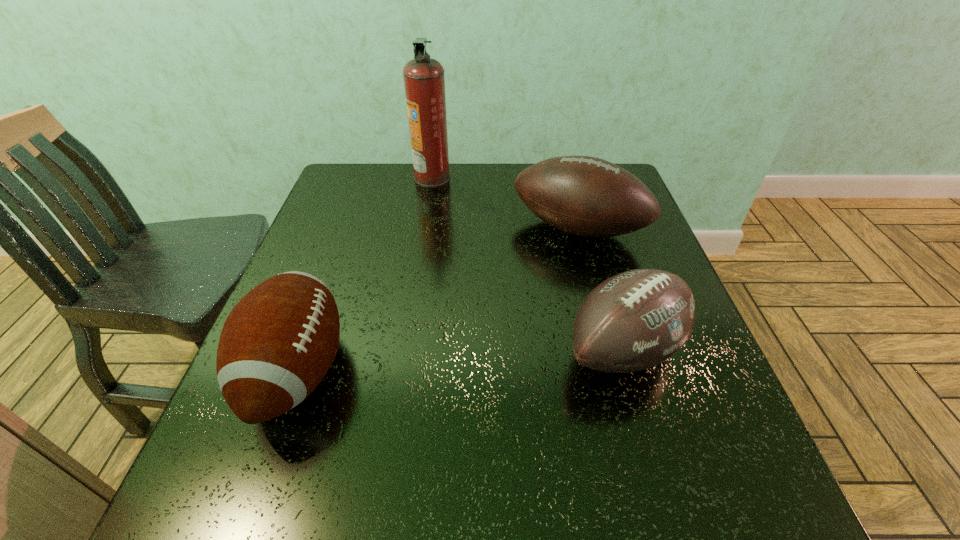
Locate an element on the screen. This screenshot has height=540, width=960. fire extinguisher is located at coordinates (424, 81).

This screenshot has width=960, height=540. Find the location of `the farthest object`. the farthest object is located at coordinates (424, 81).

This screenshot has width=960, height=540. In order to click on the second farthest object in this screenshot , I will do `click(586, 196)`.

In order to click on the leftmost football (American) in this screenshot , I will do `click(276, 345)`.

Where is `free space located at the nozzle of the fire extinguisher`? free space located at the nozzle of the fire extinguisher is located at coordinates (563, 178).

Where is `vacant space positioned on the front of the second farthest object`? vacant space positioned on the front of the second farthest object is located at coordinates point(607,332).

The width and height of the screenshot is (960, 540). In order to click on vacant space located 0.350m on the laces of the leftmost football (American) in this screenshot , I will do `click(536, 371)`.

The width and height of the screenshot is (960, 540). Identify the location of fire extinguisher present at the far edge. (424, 81).

Locate an element on the screen. This screenshot has width=960, height=540. football (American) that is at the far edge is located at coordinates (586, 196).

What are the coordinates of `object located at the left edge` in the screenshot? It's located at (276, 345).